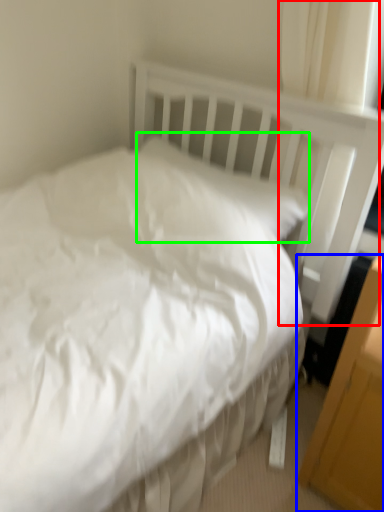
Question: Based on their relative distances, which object is nearer to curtain (highlighted by a red box)? Choose from file cabinet (highlighted by a blue box) and pillow (highlighted by a green box).

Choices:
 (A) file cabinet
 (B) pillow

Answer: (B)